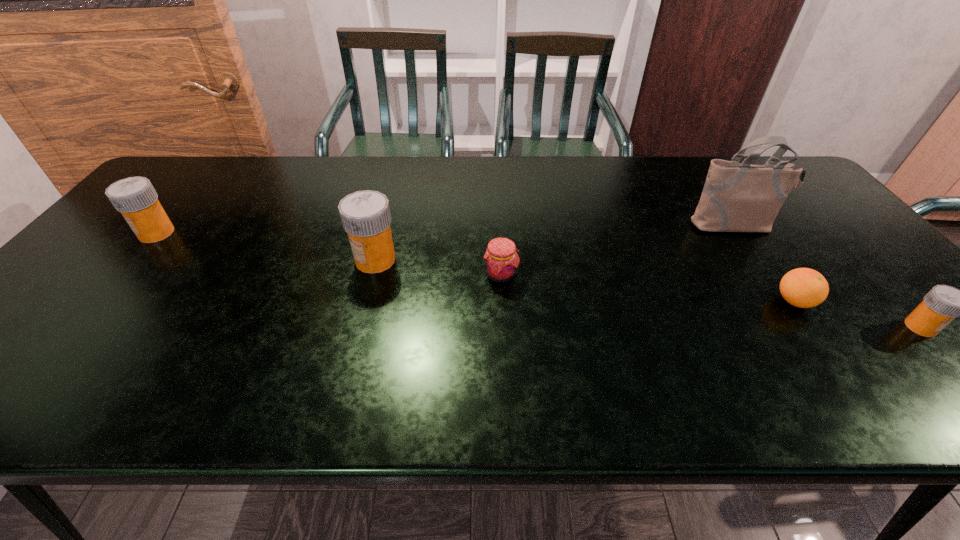
The width and height of the screenshot is (960, 540). Find the location of `blank region between the rightmost object and the orange`. blank region between the rightmost object and the orange is located at coordinates (857, 314).

Where is `empty location between the rightmost medicine and the second medicine from right to left`? The image size is (960, 540). empty location between the rightmost medicine and the second medicine from right to left is located at coordinates (648, 293).

The width and height of the screenshot is (960, 540). Find the location of `vacant region between the third object from left to right and the shoulder bag`. vacant region between the third object from left to right and the shoulder bag is located at coordinates (617, 250).

I want to click on vacant space in between the shoulder bag and the orange, so click(764, 264).

This screenshot has height=540, width=960. I want to click on vacant area between the farthest medicine and the jam, so click(328, 254).

Identify the location of free area in between the rightmost medicine and the tallest object. (828, 276).

Image resolution: width=960 pixels, height=540 pixels. In order to click on vacant space in between the fourth object from right to left and the rightmost medicine in this screenshot , I will do `click(710, 301)`.

Locate which object ranks fifth in proximity to the shoulder bag. Please provide its 2D coordinates. Your answer should be formatted as a tuple, i.e. [(x, y)], where the tuple contains the x and y coordinates of a point satisfying the conditions above.

[(135, 197)]

Select which object appears as the closest to the shortest medicine. Please provide its 2D coordinates. Your answer should be formatted as a tuple, i.e. [(x, y)], where the tuple contains the x and y coordinates of a point satisfying the conditions above.

[(803, 287)]

Identify which medicine is located as the third nearest to the jam. Please provide its 2D coordinates. Your answer should be formatted as a tuple, i.e. [(x, y)], where the tuple contains the x and y coordinates of a point satisfying the conditions above.

[(135, 197)]